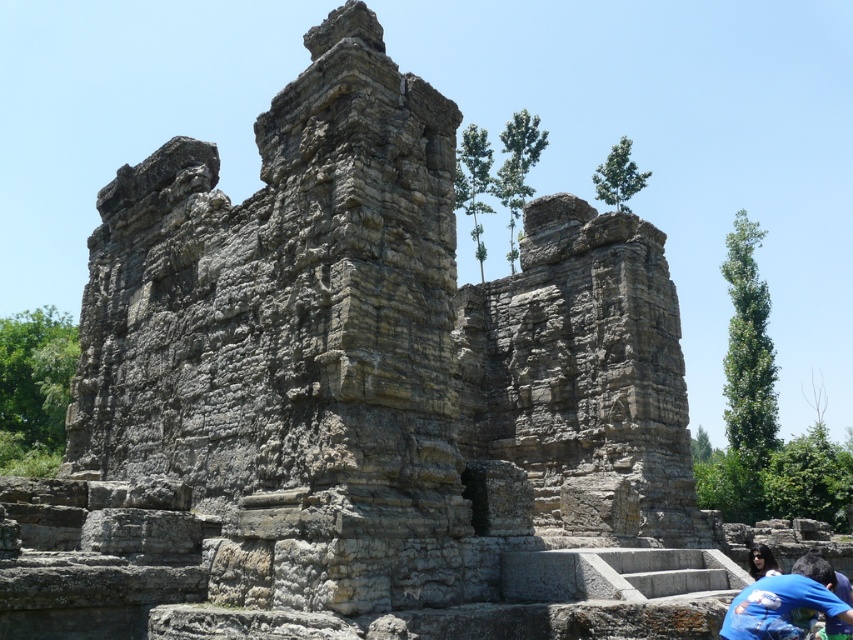
Question: Which point appears farthest from the camera in this image?

Choices:
 (A) click(x=756, y=561)
 (B) click(x=817, y=598)

Answer: (A)

Question: Does blue fabric shirt at lower right have a lesser width compared to dark blue fabric at lower right?

Choices:
 (A) yes
 (B) no

Answer: (A)

Question: Can you confirm if blue fabric shirt at lower right is positioned to the right of dark blue fabric at lower right?

Choices:
 (A) yes
 (B) no

Answer: (B)

Question: Can you confirm if blue fabric shirt at lower right is positioned to the right of dark blue fabric at lower right?

Choices:
 (A) yes
 (B) no

Answer: (B)

Question: Which object is farther from the camera taking this photo?

Choices:
 (A) dark blue fabric at lower right
 (B) blue fabric shirt at lower right

Answer: (A)